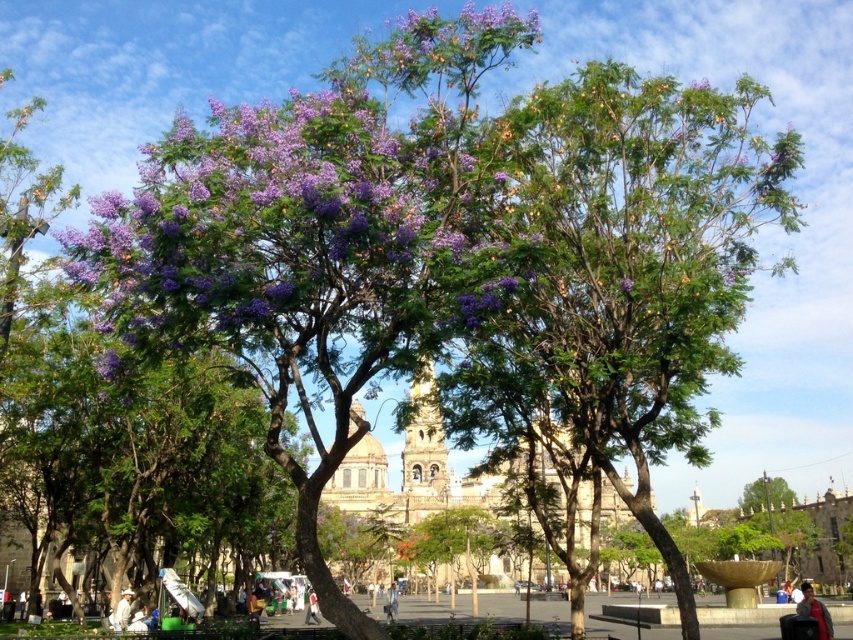
Question: Considering the real-world distances, which object is closest to the purple matte flower at upper center?

Choices:
 (A) white cotton shirt at center
 (B) purple leafy tree at center

Answer: (B)

Question: Which object is positioned closest to the red fabric jacket at lower right?

Choices:
 (A) light blue denim jacket at center
 (B) white cotton shirt at center
 (C) white fabric at center
 (D) purple leafy tree at center

Answer: (D)

Question: In this image, where is red fabric jacket at lower right located relative to light blue denim jacket at center?

Choices:
 (A) left
 (B) right

Answer: (B)

Question: Does red fabric jacket at lower right appear on the left side of white fabric at center?

Choices:
 (A) no
 (B) yes

Answer: (A)

Question: Which object is closer to the camera taking this photo?

Choices:
 (A) red fabric jacket at lower right
 (B) light blue denim jacket at center

Answer: (A)

Question: Where is white fabric at center located in relation to light blue denim jacket at center in the image?

Choices:
 (A) left
 (B) right

Answer: (A)